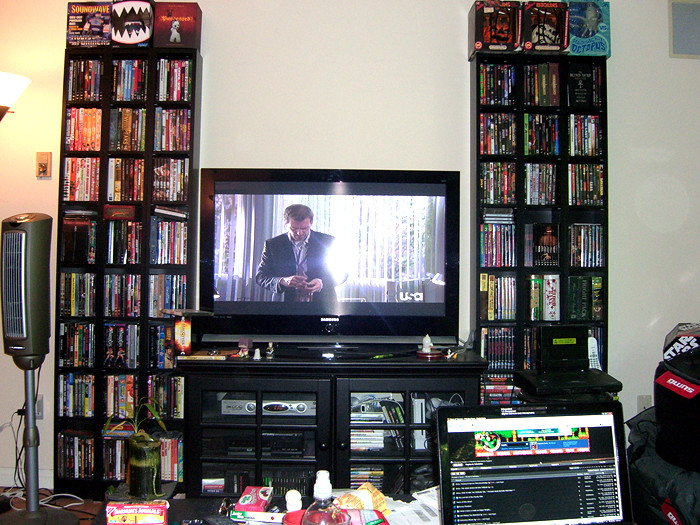
Image resolution: width=700 pixels, height=525 pixels. Identify the location of fan. (38, 250).